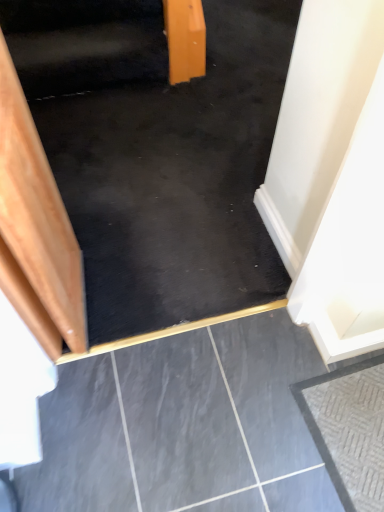
Question: Looking at the image, does black polished concrete at center, the second concrete positioned from the right, seem bigger or smaller compared to black rubber stairwell at upper center?

Choices:
 (A) small
 (B) big

Answer: (A)

Question: Relative to black rubber stairwell at upper center, is black polished concrete at center, the second concrete positioned from the right, in front or behind?

Choices:
 (A) front
 (B) behind

Answer: (A)

Question: Which object is the closest to the textured gray concrete at lower right, the second concrete positioned from the left?

Choices:
 (A) black polished concrete at center, the second concrete positioned from the right
 (B) black rubber stairwell at upper center
 (C) wooden stairs at left

Answer: (A)

Question: Which is nearer to the wooden stairs at left?

Choices:
 (A) black rubber stairwell at upper center
 (B) textured gray concrete at lower right, which appears as the first concrete when viewed from the right
 (C) black polished concrete at center, placed as the 1th concrete when sorted from left to right

Answer: (A)